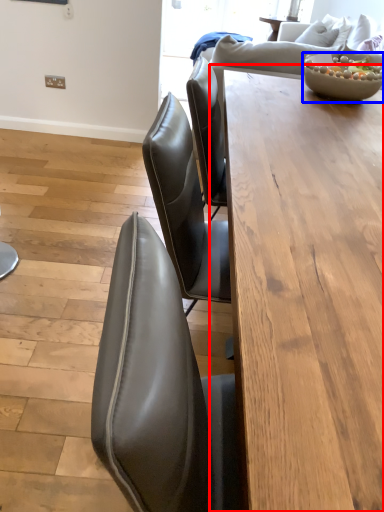
Question: Which of the following is the farthest to the observer, table (highlighted by a red box) or bowl (highlighted by a blue box)?

Choices:
 (A) table
 (B) bowl

Answer: (B)